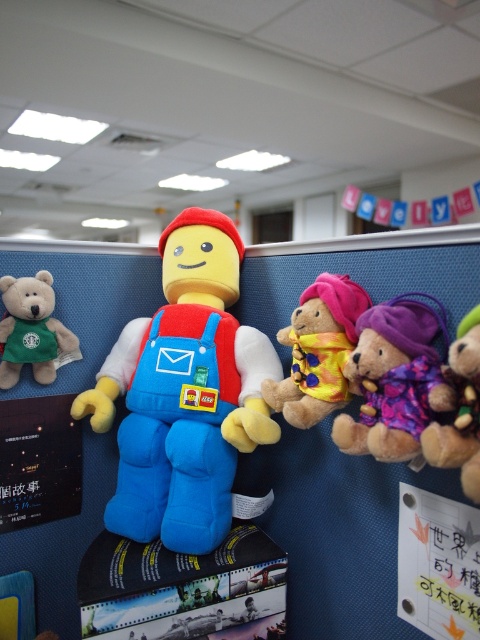
Question: Is fluffy yellow teddy bear at center to the left of purple fuzzy teddy bear at right from the viewer's perspective?

Choices:
 (A) yes
 (B) no

Answer: (A)

Question: Which point is closer to the camera?

Choices:
 (A) (181, 244)
 (B) (454, 433)
 (C) (343, 387)
 (D) (32, 298)

Answer: (B)

Question: Can you confirm if soft plush toy at center is positioned to the left of fluffy yellow teddy bear at center?

Choices:
 (A) no
 (B) yes

Answer: (B)

Question: Which point appears closest to the camera in this image?

Choices:
 (A) (342, 305)
 (B) (380, 369)
 (C) (454, 372)
 (D) (10, 304)

Answer: (C)

Question: Which point appears farthest from the camera in this image?

Choices:
 (A) (454, 436)
 (B) (410, 317)
 (C) (352, 317)

Answer: (C)

Question: Is fluffy yellow teddy bear at center to the left of purple fuzzy teddy bear at right from the viewer's perspective?

Choices:
 (A) no
 (B) yes

Answer: (B)